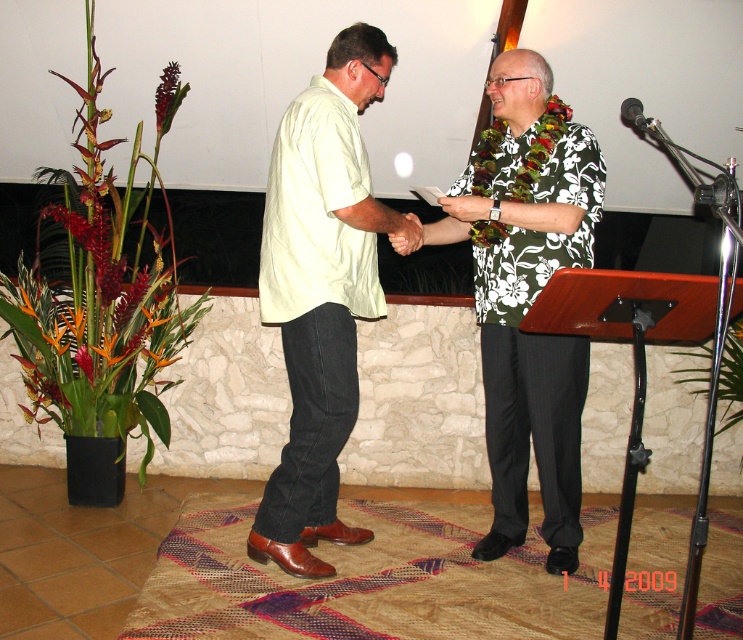
Question: Which of the following is the closest to the observer?

Choices:
 (A) brown leather hand at center
 (B) floral print shirt at center
 (C) light beige cotton shirt at center

Answer: (C)

Question: Based on their relative distances, which object is nearer to the floral print shirt at center?

Choices:
 (A) brown leather hand at center
 (B) light beige cotton shirt at center
 (C) metallic silver microphone at upper right

Answer: (A)

Question: Considering the relative positions of floral print shirt at center and metallic silver microphone at upper right in the image provided, where is floral print shirt at center located with respect to metallic silver microphone at upper right?

Choices:
 (A) left
 (B) right

Answer: (A)

Question: Can you confirm if floral print shirt at center is positioned above brown leather hand at center?

Choices:
 (A) no
 (B) yes

Answer: (A)

Question: Considering the real-world distances, which object is farthest from the floral print shirt at center?

Choices:
 (A) light beige cotton shirt at center
 (B) brown leather hand at center
 (C) metallic silver microphone at upper right

Answer: (C)

Question: Does floral print shirt at center lie behind metallic silver microphone at upper right?

Choices:
 (A) yes
 (B) no

Answer: (A)